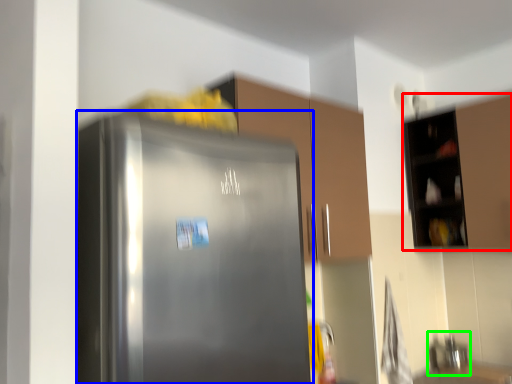
Question: Based on their relative distances, which object is farther from cabinetry (highlighted by a red box)? Choose from refrigerator (highlighted by a blue box) and sink (highlighted by a green box).

Choices:
 (A) refrigerator
 (B) sink

Answer: (A)